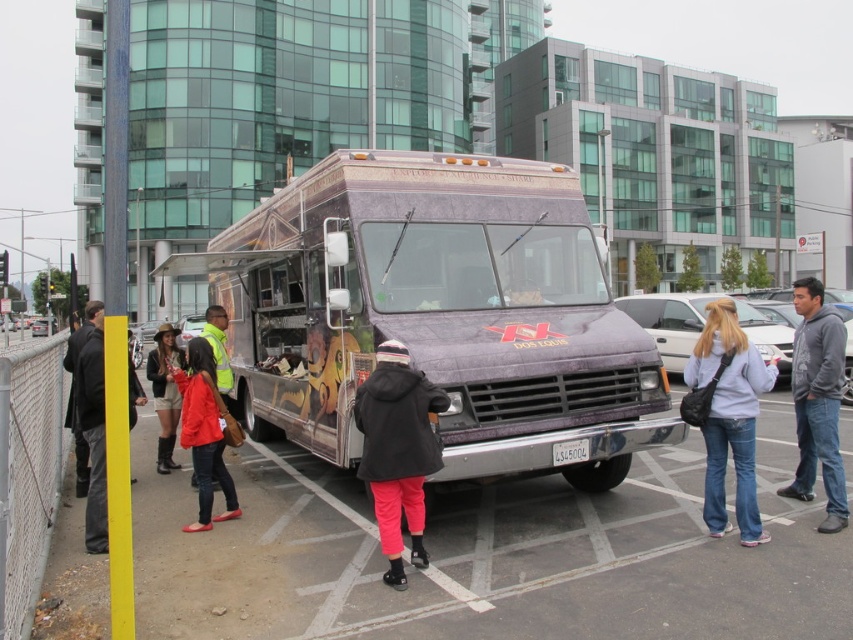
You are standing at the center of the food truck area and want to find the denim jeans at lower right. According to the coordinates provided, in which direction should you move from your current position to locate them?

The denim jeans at lower right are located at coordinates point (729, 417). Since you are at the center, moving towards the lower right direction will help you find them.

You are a customer waiting in line at the food truck. You notice the matte purple van at center and the gray hoodie at right. Which object is closer to you?

The matte purple van at center is closer to you since it has a smaller size compared to the gray hoodie at right.

You are a customer waiting in line at the food truck. You notice the black matte coat at center and the matte purple van at center. Which one is closer to you?

The matte purple van at center is closer to you because the black matte coat at center is behind it.